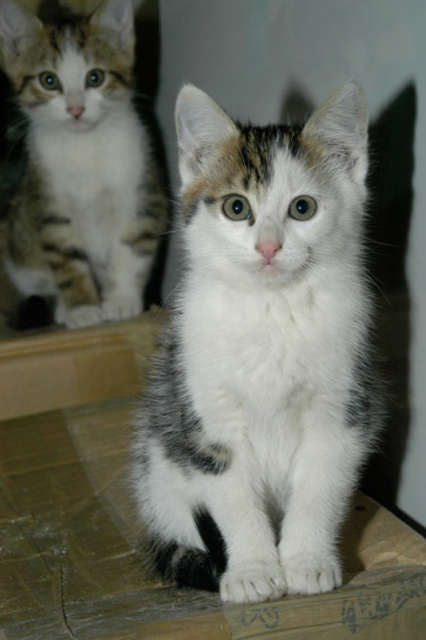
You are a photographer trying to capture both kittens in a single photo. Given that the white fluffy cat at center is shorter than the white fur cat at center, which kitten should you adjust your camera angle to focus on first to ensure both are in frame?

The white fluffy cat at center is shorter than the white fur cat at center, so you should focus on the white fluffy cat at center first to ensure both are in frame.

You are trying to pet the closest cat to you in the image. Which cat should you choose between the white fluffy cat at center and the white fur cat at center?

The white fluffy cat at center is closer to the viewer, so you should choose the white fluffy cat at center to pet.

You are observing two kittens on a wooden surface. There is a white fluffy cat at center and a white fur cat at center. Which one is positioned to the right?

The white fluffy cat at center is to the right of the white fur cat at center.